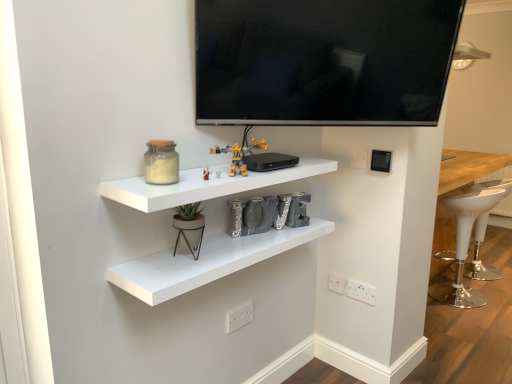
Identify the location of vacant point to the left of metallic yellow toy at center, positioned as the second toy in top-to-bottom order. (163, 178).